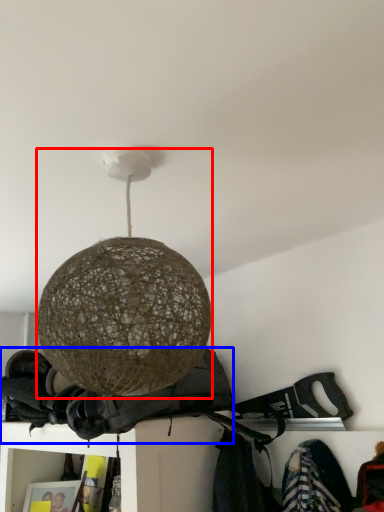
Question: Which of the following is the farthest to the observer, lamp (highlighted by a red box) or clothing (highlighted by a blue box)?

Choices:
 (A) lamp
 (B) clothing

Answer: (B)